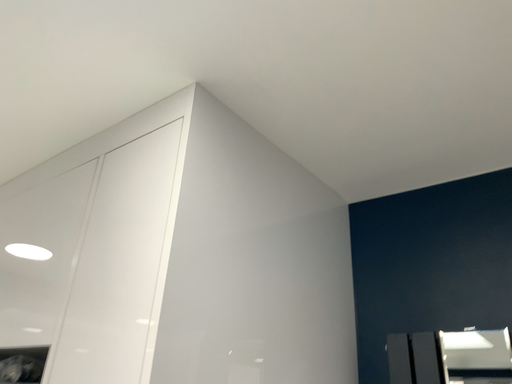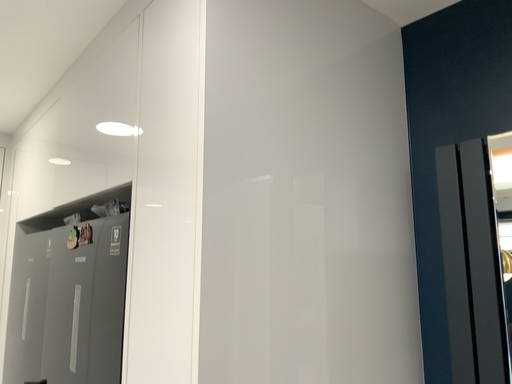
Question: How did the camera likely rotate when shooting the video?

Choices:
 (A) rotated downward
 (B) rotated upward

Answer: (A)